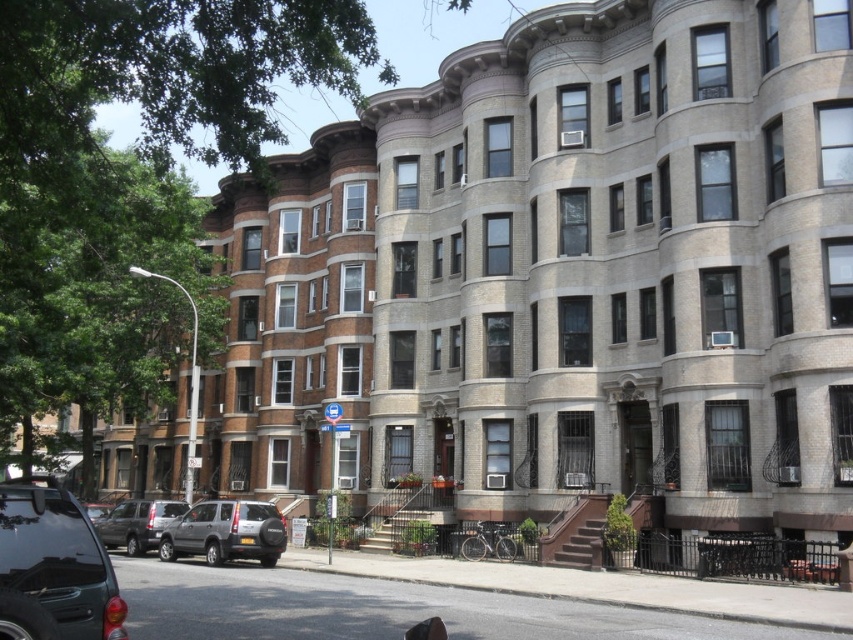
Question: Which point is closer to the camera?

Choices:
 (A) (16, 518)
 (B) (88, 513)
 (C) (206, 508)
 (D) (161, 502)

Answer: (A)

Question: Is silver metallic suv at center to the left of silver metallic suv at lower left from the viewer's perspective?

Choices:
 (A) yes
 (B) no

Answer: (B)

Question: Can you confirm if silver metallic suv at center is positioned to the left of shiny silver suv at center?

Choices:
 (A) no
 (B) yes

Answer: (A)

Question: From the image, what is the correct spatial relationship of silver metallic suv at center in relation to shiny silver suv at center?

Choices:
 (A) left
 (B) right

Answer: (B)

Question: Which of these objects is positioned closest to the silver metallic suv at center?

Choices:
 (A) silver metallic suv at lower left
 (B) matte black suv at lower left
 (C) shiny silver suv at center

Answer: (A)

Question: Which of the following is the farthest from the observer?

Choices:
 (A) silver metallic suv at center
 (B) matte black suv at lower left
 (C) silver metallic suv at lower left

Answer: (A)